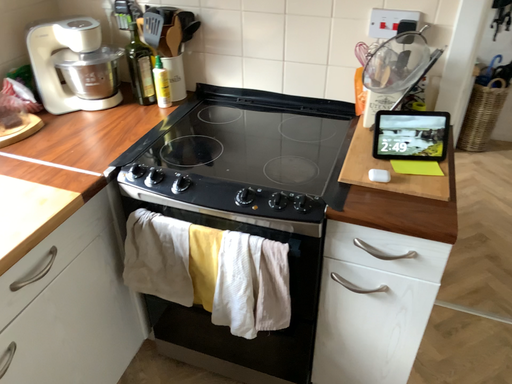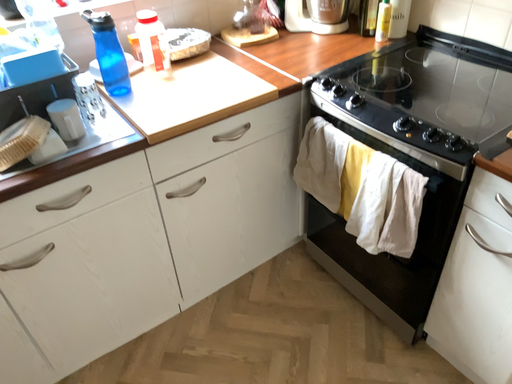
Question: Which way did the camera rotate in the video?

Choices:
 (A) rotated right
 (B) rotated left

Answer: (B)